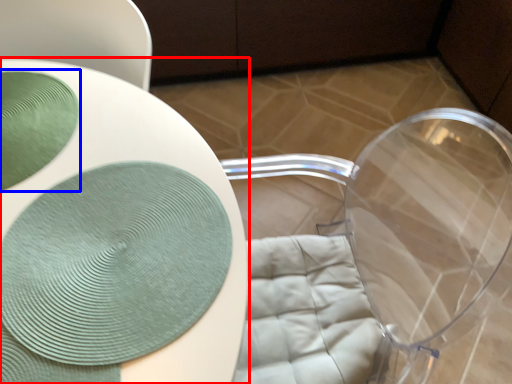
Question: Among these objects, which one is nearest to the camera, table (highlighted by a red box) or glass plate (highlighted by a blue box)?

Choices:
 (A) table
 (B) glass plate

Answer: (A)